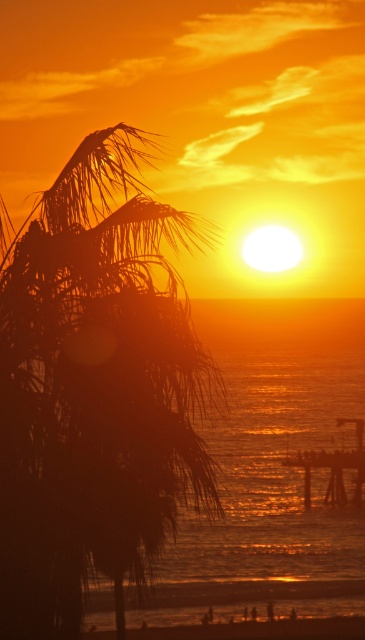
Who is taller, glistening metallic water at center or wooden pier at center?

With more height is glistening metallic water at center.

This screenshot has height=640, width=365. Describe the element at coordinates (267, 493) in the screenshot. I see `glistening metallic water at center` at that location.

The width and height of the screenshot is (365, 640). In order to click on glistening metallic water at center in this screenshot , I will do `click(267, 493)`.

Which is in front, point (104, 502) or point (347, 442)?

Point (104, 502) is in front.

Is point (139, 440) closer to viewer compared to point (283, 499)?

Yes, it is in front of point (283, 499).

The height and width of the screenshot is (640, 365). I want to click on silhouette leafy palm at left, so click(94, 388).

Is silhouette leafy palm at left taller than wooden pier at center?

Correct, silhouette leafy palm at left is much taller as wooden pier at center.

Based on the photo, is silhouette leafy palm at left bigger than wooden pier at center?

Correct, silhouette leafy palm at left is larger in size than wooden pier at center.

Which is behind, point (100, 451) or point (313, 454)?

The point (313, 454) is more distant.

Find the location of a particular element. The height and width of the screenshot is (640, 365). silhouette leafy palm at left is located at coordinates (94, 388).